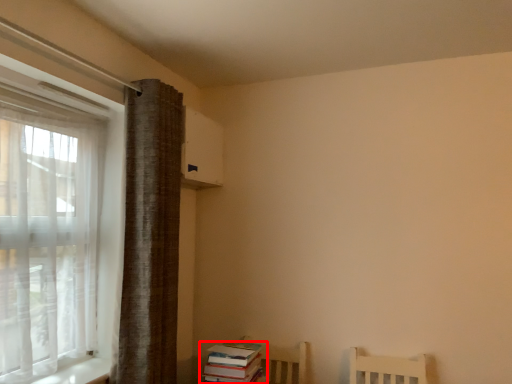
Question: From the image's perspective, where is book (annotated by the red box) located relative to curtain?

Choices:
 (A) above
 (B) below

Answer: (B)